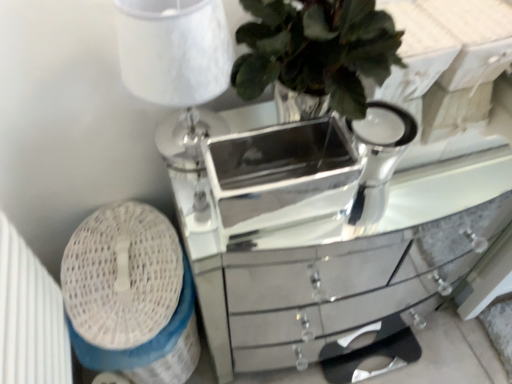
Question: Considering the relative sizes of white textured lampshade at upper left and silver/metallic mirrored tray at center in the image provided, is white textured lampshade at upper left wider than silver/metallic mirrored tray at center?

Choices:
 (A) yes
 (B) no

Answer: (A)

Question: Is silver/metallic mirrored tray at center located within white textured lampshade at upper left?

Choices:
 (A) yes
 (B) no

Answer: (B)

Question: Is white textured lampshade at upper left aimed at silver/metallic mirrored tray at center?

Choices:
 (A) no
 (B) yes

Answer: (A)

Question: Considering the relative positions of white textured lampshade at upper left and silver/metallic mirrored tray at center in the image provided, is white textured lampshade at upper left behind silver/metallic mirrored tray at center?

Choices:
 (A) no
 (B) yes

Answer: (A)

Question: From the image's perspective, is white textured lampshade at upper left located above silver/metallic mirrored tray at center?

Choices:
 (A) yes
 (B) no

Answer: (A)

Question: Is the depth of white textured lampshade at upper left less than that of silver/metallic mirrored tray at center?

Choices:
 (A) no
 (B) yes

Answer: (B)

Question: Would you say mirrored silver chest of drawers at center is a long distance from silver/metallic mirrored tray at center?

Choices:
 (A) no
 (B) yes

Answer: (A)

Question: Considering the relative sizes of mirrored silver chest of drawers at center and silver/metallic mirrored tray at center in the image provided, is mirrored silver chest of drawers at center taller than silver/metallic mirrored tray at center?

Choices:
 (A) yes
 (B) no

Answer: (A)

Question: Is mirrored silver chest of drawers at center in contact with silver/metallic mirrored tray at center?

Choices:
 (A) no
 (B) yes

Answer: (A)

Question: Is mirrored silver chest of drawers at center positioned with its back to silver/metallic mirrored tray at center?

Choices:
 (A) no
 (B) yes

Answer: (A)

Question: Would you say silver/metallic mirrored tray at center is part of mirrored silver chest of drawers at center's contents?

Choices:
 (A) yes
 (B) no

Answer: (B)

Question: Is mirrored silver chest of drawers at center at the right side of silver/metallic mirrored tray at center?

Choices:
 (A) yes
 (B) no

Answer: (A)

Question: Is silver/metallic mirrored tray at center to the left of white textured lampshade at upper left from the viewer's perspective?

Choices:
 (A) no
 (B) yes

Answer: (A)